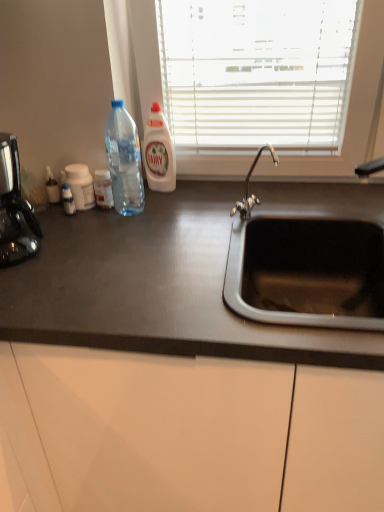
Locate an element on the screen. The width and height of the screenshot is (384, 512). free spot in front of clear plastic bottle at center, which ranks as the second bottle in right-to-left order is located at coordinates (109, 230).